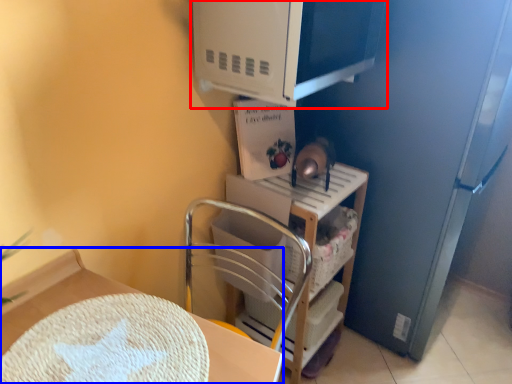
Question: Which point is closer to the camera, appliance (highlighted by a red box) or furniture (highlighted by a blue box)?

Choices:
 (A) appliance
 (B) furniture

Answer: (B)